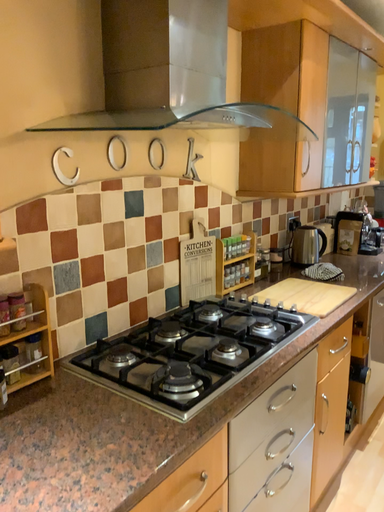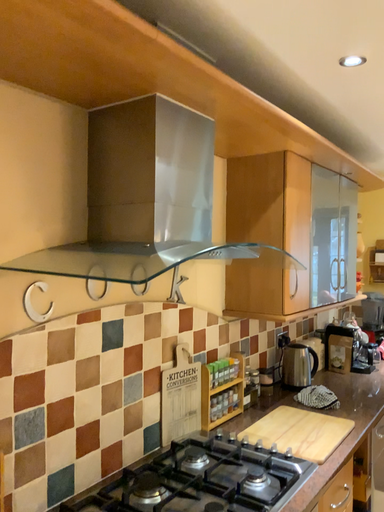
Question: How did the camera likely rotate when shooting the video?

Choices:
 (A) rotated upward
 (B) rotated downward

Answer: (A)